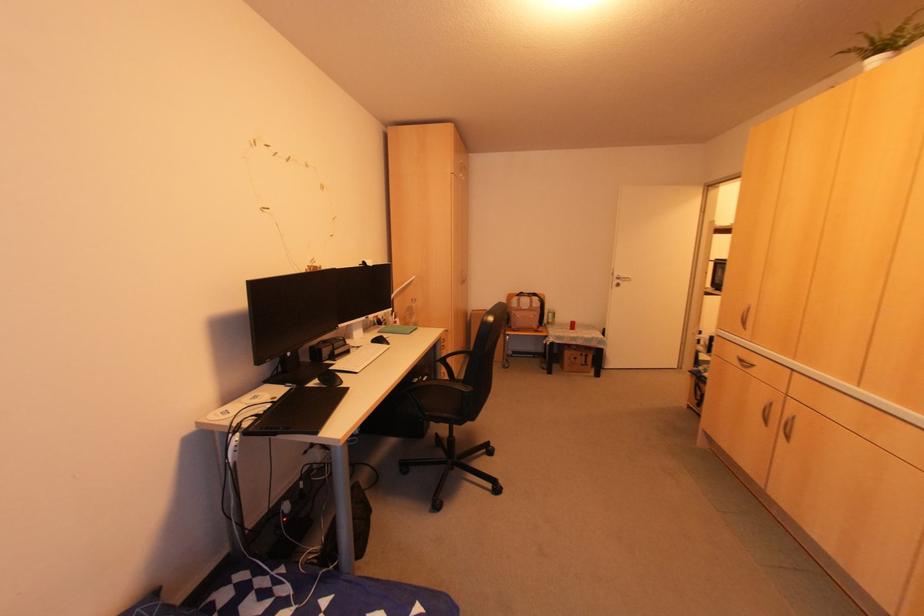
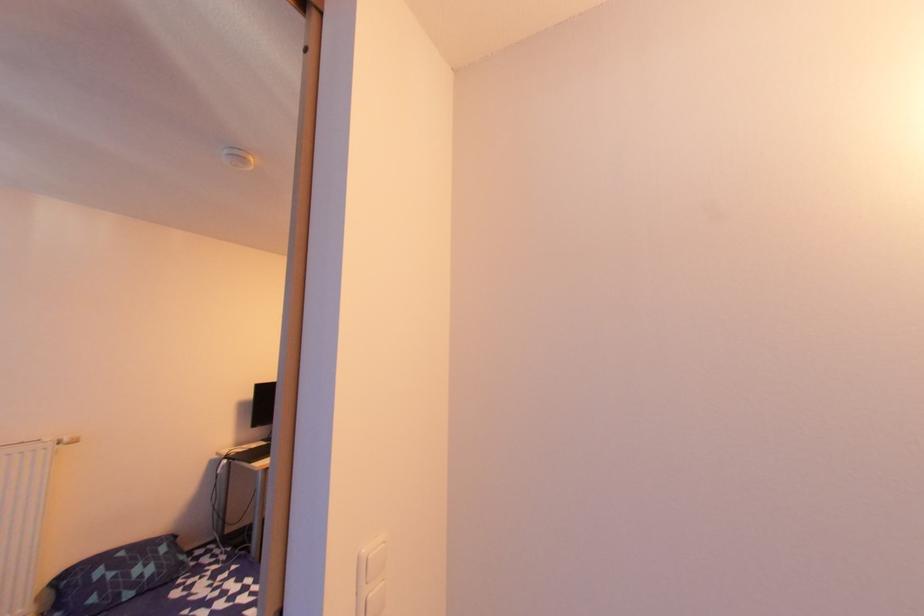
What movement of the cameraman would produce the second image?

The movement direction of the cameraman is right, backward.